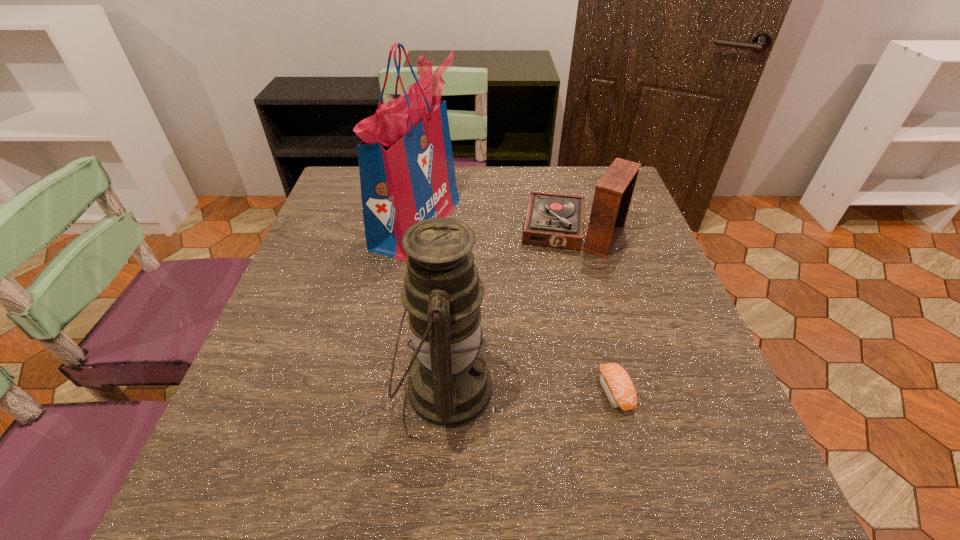
Identify the location of object that is at the left edge. This screenshot has width=960, height=540. (406, 166).

Identify the location of phonograph record that is positioned at the right edge. (554, 220).

Locate an element on the screen. The image size is (960, 540). sushi situated at the right edge is located at coordinates (614, 380).

Identify the location of object positioned at the far left corner. (406, 166).

I want to click on object that is at the far right corner, so click(x=554, y=220).

Find the location of a particular element. The image size is (960, 540). vacant area at the far edge of the desktop is located at coordinates (460, 188).

Locate an element on the screen. The height and width of the screenshot is (540, 960). vacant area at the left edge is located at coordinates (320, 318).

Find the location of a particular element. The height and width of the screenshot is (540, 960). free space at the right edge of the desktop is located at coordinates (727, 403).

Where is `vacant region at the near right corner of the desktop`? This screenshot has height=540, width=960. vacant region at the near right corner of the desktop is located at coordinates (671, 508).

At what (x,y) coordinates should I click in order to perform the action: click on vacant point located between the tallest object and the third tallest object. Please return your answer as a coordinate pair (x, y). Looking at the image, I should click on (495, 228).